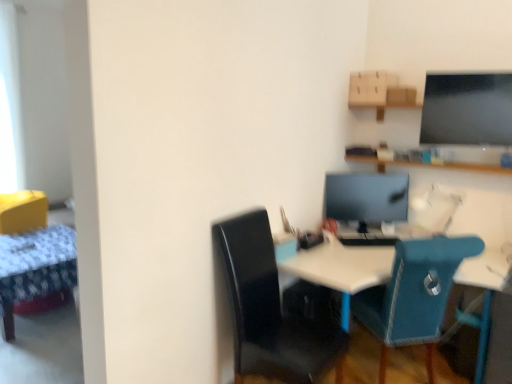
Question: Is matte black monitor at center inside or outside of wooden table at left?

Choices:
 (A) inside
 (B) outside

Answer: (B)

Question: From the image's perspective, is matte black monitor at center positioned above or below wooden table at left?

Choices:
 (A) above
 (B) below

Answer: (A)

Question: Which of these objects is positioned farthest from the black leather chair at center, which is the first chair in left-to-right order?

Choices:
 (A) wooden table at left
 (B) teal fabric chair at center, acting as the second chair starting from the left
 (C) matte black monitor at center
 (D) white plastic desk at center

Answer: (A)

Question: Which of these objects is positioned farthest from the wooden table at left?

Choices:
 (A) white plastic desk at center
 (B) black leather chair at center, which is the first chair in left-to-right order
 (C) teal fabric chair at center, which is the first chair from right to left
 (D) matte black monitor at center

Answer: (C)